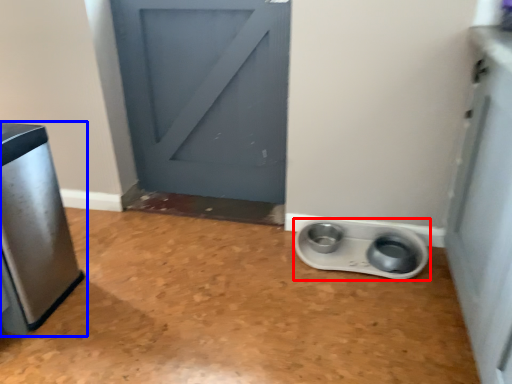
Question: Which of the following is the farthest to the observer, appliance (highlighted by a red box) or home appliance (highlighted by a blue box)?

Choices:
 (A) appliance
 (B) home appliance

Answer: (A)